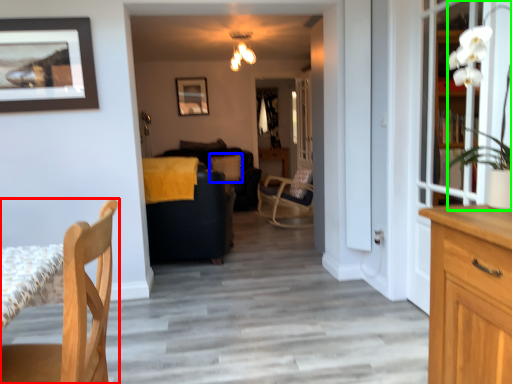
Question: Which object is positioned closest to chair (highlighted by a red box)? Select from pillow (highlighted by a blue box) and houseplant (highlighted by a green box).

Choices:
 (A) pillow
 (B) houseplant

Answer: (B)